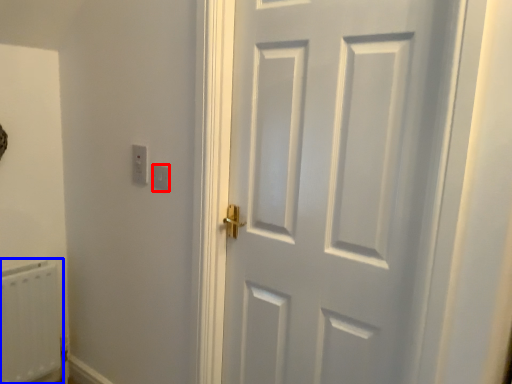
Question: Which of the following is the farthest to the observer, light switch (highlighted by a red box) or radiator (highlighted by a blue box)?

Choices:
 (A) light switch
 (B) radiator

Answer: (B)